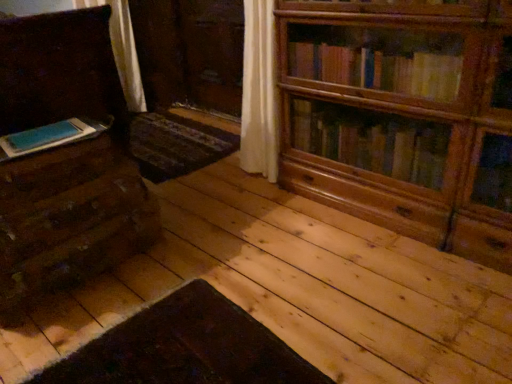
Locate an element on the screen. The height and width of the screenshot is (384, 512). free space to the left of wooden bookcase at upper right is located at coordinates (242, 240).